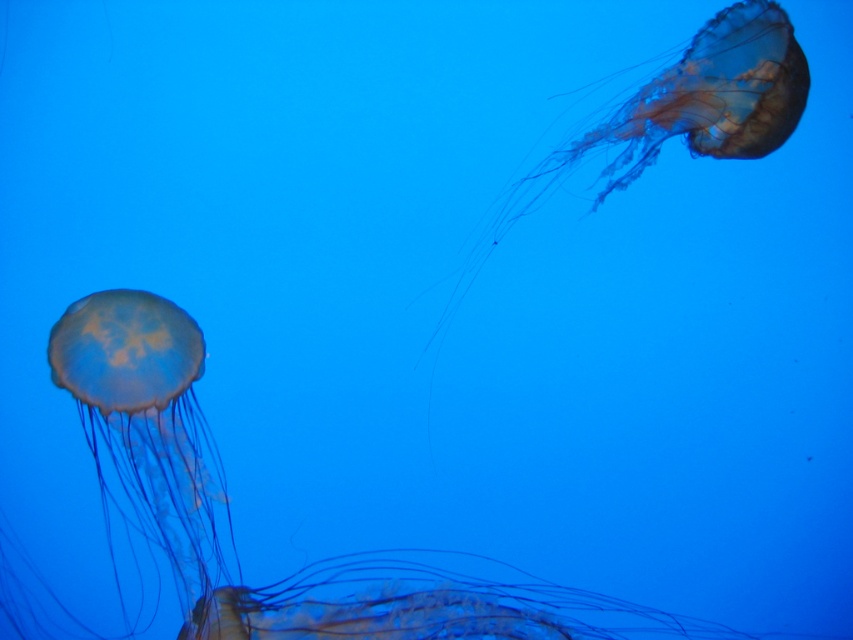
You are observing two jellyfish in an aquarium. You see a translucent yellow jellyfish at lower left and another jellyfish at a different position. Which jellyfish is closer to the bottom of the aquarium?

The translucent yellow jellyfish at lower left is closer to the bottom of the aquarium because its position at point 0.273 on the y axis indicates it is lower than the other jellyfish.

You are an underwater photographer aiming to capture both the translucent yellow jellyfish at lower left and the translucent gelatinous at upper right in a single frame. Based on their sizes, which jellyfish will appear smaller in your photo?

The translucent yellow jellyfish at lower left will appear smaller in the photo because it is not as tall as the translucent gelatinous at upper right.